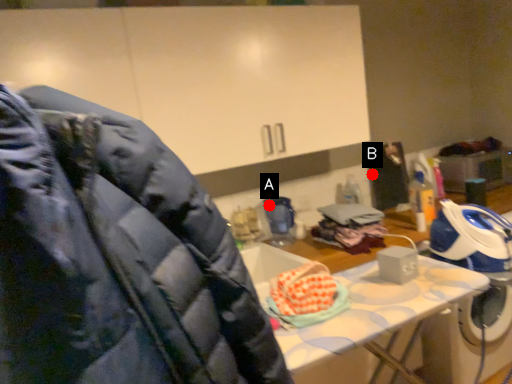
Question: Two points are circled on the image, labeled by A and B beside each circle. Among these points, which one is farthest from the camera?

Choices:
 (A) A is further
 (B) B is further

Answer: (B)